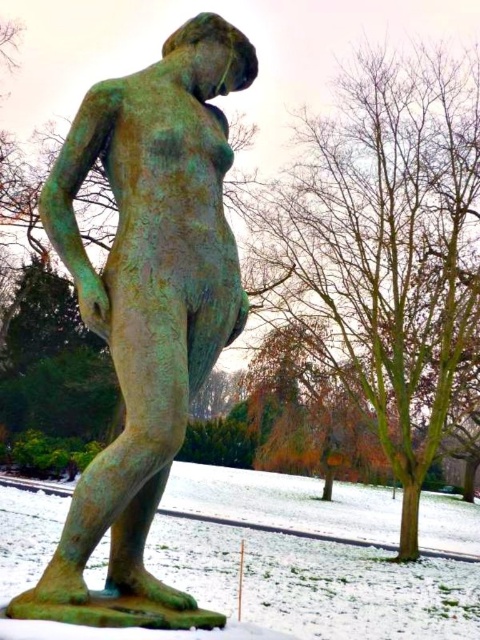
Is green patina bronze statue at center to the left of green patina snow at lower left from the viewer's perspective?

In fact, green patina bronze statue at center is to the right of green patina snow at lower left.

Is green patina bronze statue at center smaller than green patina snow at lower left?

Yes.

The height and width of the screenshot is (640, 480). I want to click on green patina bronze statue at center, so click(x=146, y=307).

Locate an element on the screen. green patina bronze statue at center is located at coordinates (146, 307).